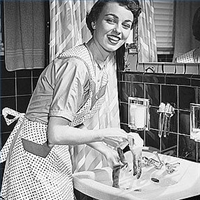
This screenshot has height=200, width=200. Find the location of `sink spout`. sink spout is located at coordinates (155, 152).